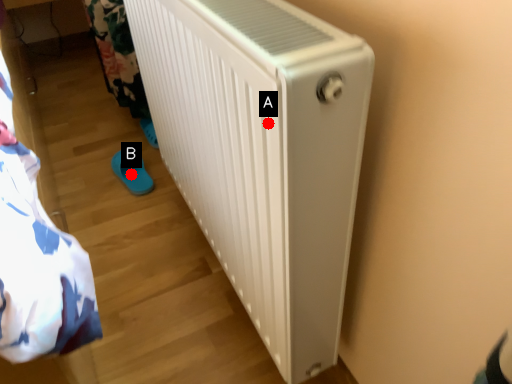
Question: Two points are circled on the image, labeled by A and B beside each circle. Which of the following is the closest to the observer?

Choices:
 (A) A is closer
 (B) B is closer

Answer: (A)